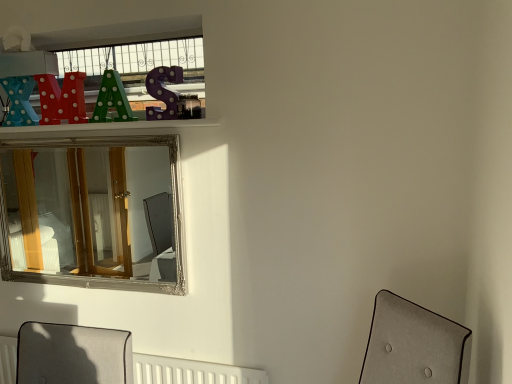
Question: Considering the positions of white textured radiator at lower center and silver/gilded mirror at upper center in the image, is white textured radiator at lower center bigger or smaller than silver/gilded mirror at upper center?

Choices:
 (A) big
 (B) small

Answer: (B)

Question: In terms of height, does white textured radiator at lower center look taller or shorter compared to silver/gilded mirror at upper center?

Choices:
 (A) tall
 (B) short

Answer: (B)

Question: Is white textured radiator at lower center wider or thinner than silver/gilded mirror at upper center?

Choices:
 (A) thin
 (B) wide

Answer: (A)

Question: In terms of width, does silver/gilded mirror at upper center look wider or thinner when compared to white textured radiator at lower center?

Choices:
 (A) wide
 (B) thin

Answer: (A)

Question: Visually, is silver/gilded mirror at upper center positioned to the left or to the right of white textured radiator at lower center?

Choices:
 (A) left
 (B) right

Answer: (A)

Question: Relative to white textured radiator at lower center, is silver/gilded mirror at upper center in front or behind?

Choices:
 (A) front
 (B) behind

Answer: (A)

Question: From the image's perspective, relative to white textured radiator at lower center, is silver/gilded mirror at upper center above or below?

Choices:
 (A) below
 (B) above

Answer: (B)